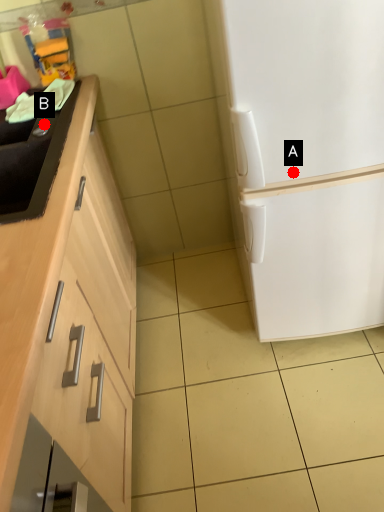
Question: Two points are circled on the image, labeled by A and B beside each circle. Which point appears closest to the camera in this image?

Choices:
 (A) A is closer
 (B) B is closer

Answer: (A)